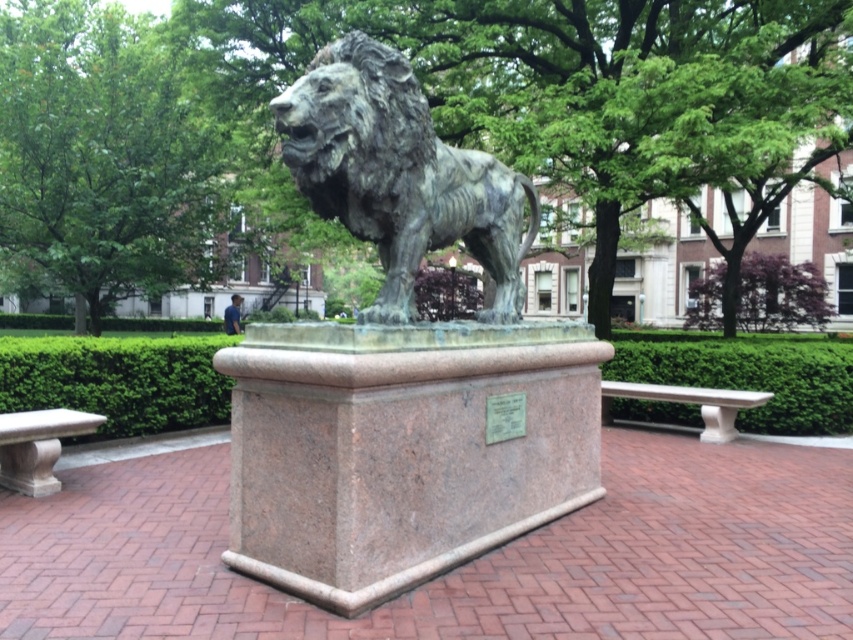
You are a photographer standing at a certain distance from the bronze textured lion at center. You want to take a photo where the lion fills the frame perfectly without any distortion. The recommended minimum distance for this is 3 meters. Is your current position suitable?

The distance between you and the bronze textured lion at center is 3.77 meters. Since the recommended minimum distance is 3 meters, your current position is suitable as it meets the requirement.

What is the spatial relationship between the bronze textured lion at center and the white marble bench at right?

The bronze textured lion at center is positioned to the left of the white marble bench at right.

You are standing at the center of the park and want to find the green leafy hedge at lower left. According to the coordinates provided, in which direction should you walk to locate it?

The green leafy hedge at lower left is located at coordinates point [119,380]. Since the coordinates are lower in the y value, you should walk downward from the center to reach the green leafy hedge at lower left.